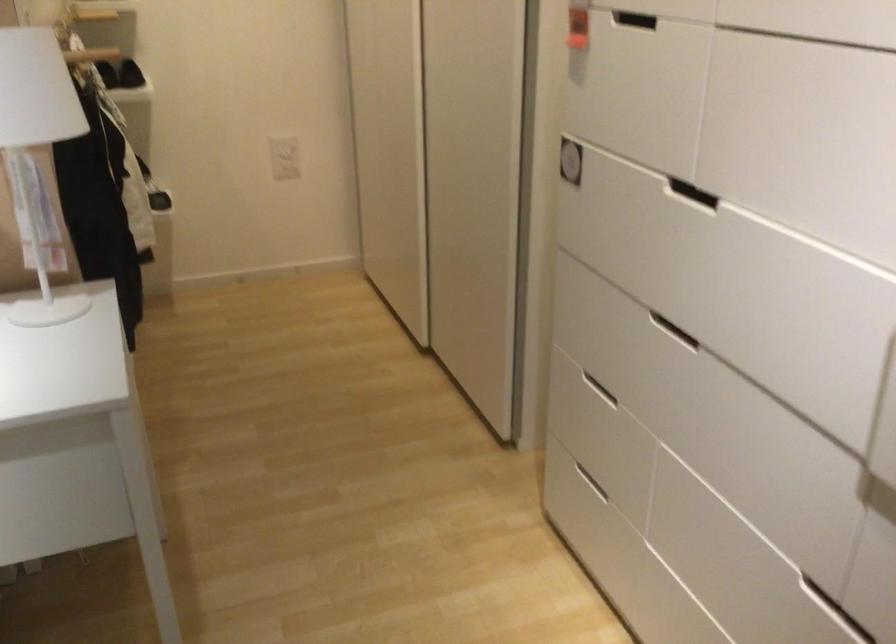
Locate an element on the screen. white light switch is located at coordinates click(283, 156).